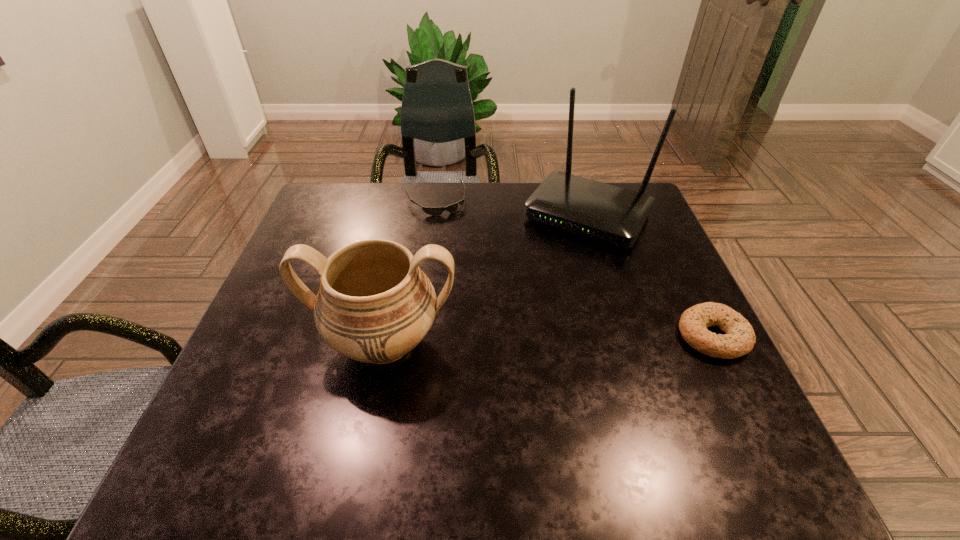
At what (x,y) coordinates should I click in order to perform the action: click on vacant space located 0.070m on the front-facing side of the router. Please return your answer as a coordinate pair (x, y). Looking at the image, I should click on (552, 264).

The image size is (960, 540). Identify the location of vacant space located 0.180m on the front-facing side of the router. (534, 292).

Locate an element on the screen. The height and width of the screenshot is (540, 960). sunglasses situated at the far edge is located at coordinates (434, 211).

The image size is (960, 540). Find the location of `router present at the far edge`. router present at the far edge is located at coordinates (610, 214).

Locate an element on the screen. This screenshot has height=540, width=960. object positioned at the near edge is located at coordinates (374, 305).

Locate an element on the screen. The width and height of the screenshot is (960, 540). object that is at the left edge is located at coordinates (374, 305).

The image size is (960, 540). Identify the location of bagel that is at the right edge. (739, 340).

Where is `router present at the right edge`? This screenshot has width=960, height=540. router present at the right edge is located at coordinates (610, 214).

The width and height of the screenshot is (960, 540). Identify the location of object at the near left corner. (374, 305).

You are a GUI agent. You are given a task and a screenshot of the screen. Output one action in this format:
    pyautogui.click(x=<x>, y=<y>)
    Task: Click on the object at the far right corner
    This screenshot has width=960, height=540.
    Given the screenshot: What is the action you would take?
    pyautogui.click(x=610, y=214)